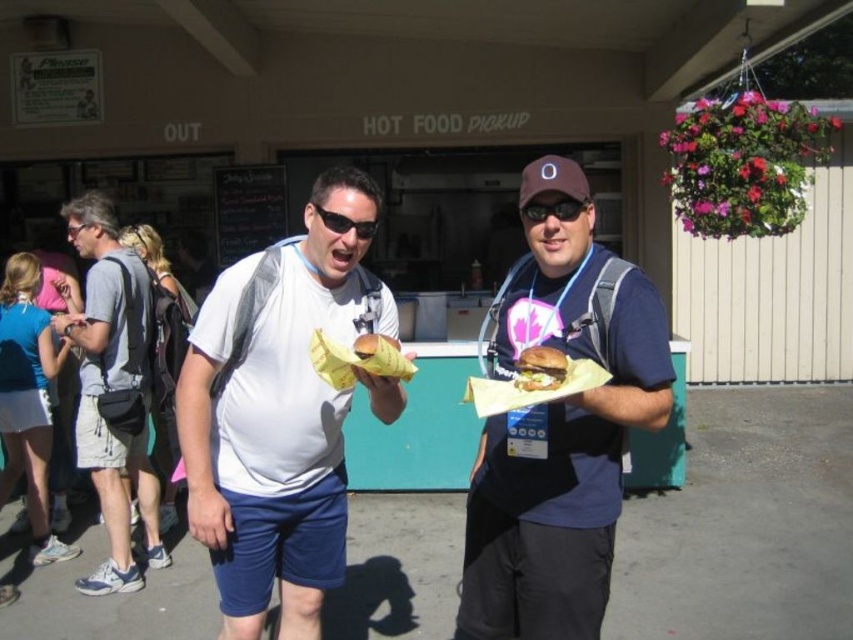
Who is positioned more to the left, white matte shirt at center or black plastic goggles at center?

white matte shirt at center

Which is more to the right, white matte shirt at center or black plastic goggles at center?

black plastic goggles at center is more to the right.

Where is `white matte shirt at center`? white matte shirt at center is located at coordinates (277, 413).

The image size is (853, 640). I want to click on gray fabric backpack at left, so click(x=113, y=392).

Can you confirm if gray fabric backpack at left is taller than black plastic sunglasses at center?

Yes.

Is point (78, 337) positioned before point (347, 227)?

No, (78, 337) is further to viewer.

At what (x,y) coordinates should I click in order to perform the action: click on gray fabric backpack at left. Please return your answer as a coordinate pair (x, y). Looking at the image, I should click on pos(113,392).

Between white matte shirt at center and gray fabric backpack at left, which one is positioned lower?

gray fabric backpack at left is below.

The width and height of the screenshot is (853, 640). What are the coordinates of `white matte shirt at center` in the screenshot? It's located at (277, 413).

Between point (248, 460) and point (113, 476), which one is positioned behind?

The point (113, 476) is behind.

This screenshot has height=640, width=853. I want to click on white matte shirt at center, so click(277, 413).